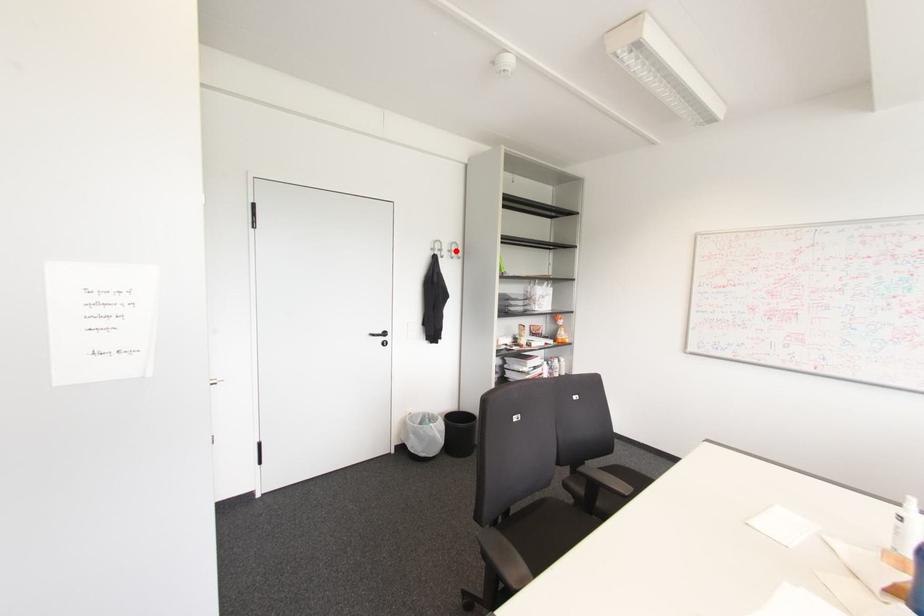
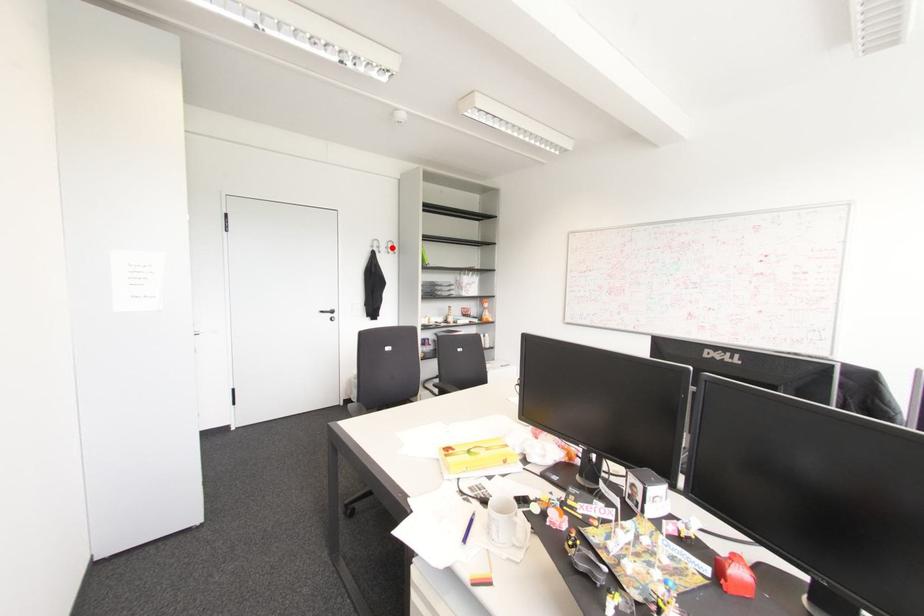
I am providing you with two images of the same scene from different viewpoints. A red point is marked on the first image and another point is marked on the second image. Do the highlighted points in image1 and image2 indicate the same real-world spot?

Yes